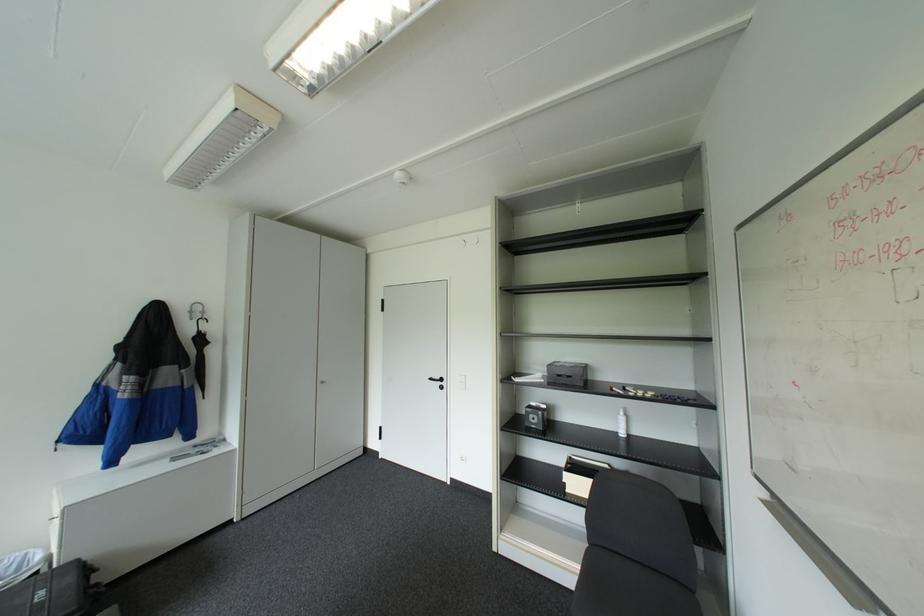
Locate an element on the screen. chair sitting surface is located at coordinates (627, 589).